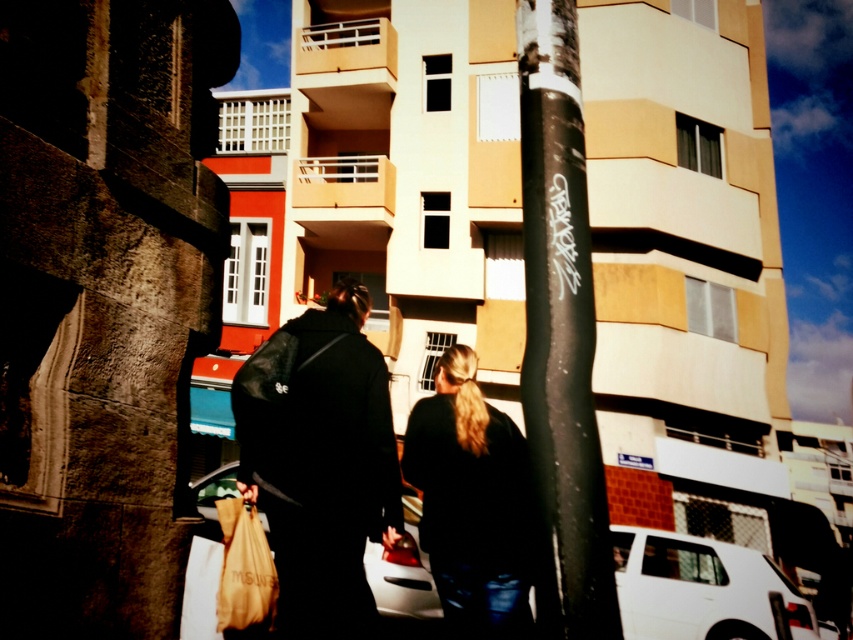
Which is behind, point (338, 326) or point (265, 545)?

The point (338, 326) is behind.

Does black leather jacket at center appear on the right side of matte brown paper bag at lower left?

Indeed, black leather jacket at center is positioned on the right side of matte brown paper bag at lower left.

Measure the distance between point (375,355) and camera.

A distance of 3.42 meters exists between point (375,355) and camera.

Where is `black leather jacket at center`? black leather jacket at center is located at coordinates (321, 461).

Consider the image. Is black matte pole at center taller than matte brown paper bag at lower left?

Yes, black matte pole at center is taller than matte brown paper bag at lower left.

Is point (593, 330) positioned before point (274, 579)?

Yes, it is in front of point (274, 579).

You are a GUI agent. You are given a task and a screenshot of the screen. Output one action in this format:
    pyautogui.click(x=<x>, y=<y>)
    Task: Click on the black matte pole at center
    Image resolution: width=853 pixels, height=640 pixels.
    Given the screenshot: What is the action you would take?
    pyautogui.click(x=561, y=328)

Locate an element on the screen. This screenshot has width=853, height=640. black leather jacket at center is located at coordinates click(x=321, y=461).

What are the coordinates of `black leather jacket at center` in the screenshot? It's located at (321, 461).